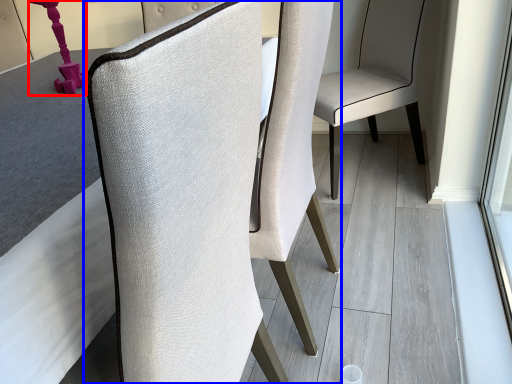
Question: Among these objects, which one is farthest to the camera, table lamp (highlighted by a red box) or chair (highlighted by a blue box)?

Choices:
 (A) table lamp
 (B) chair

Answer: (A)